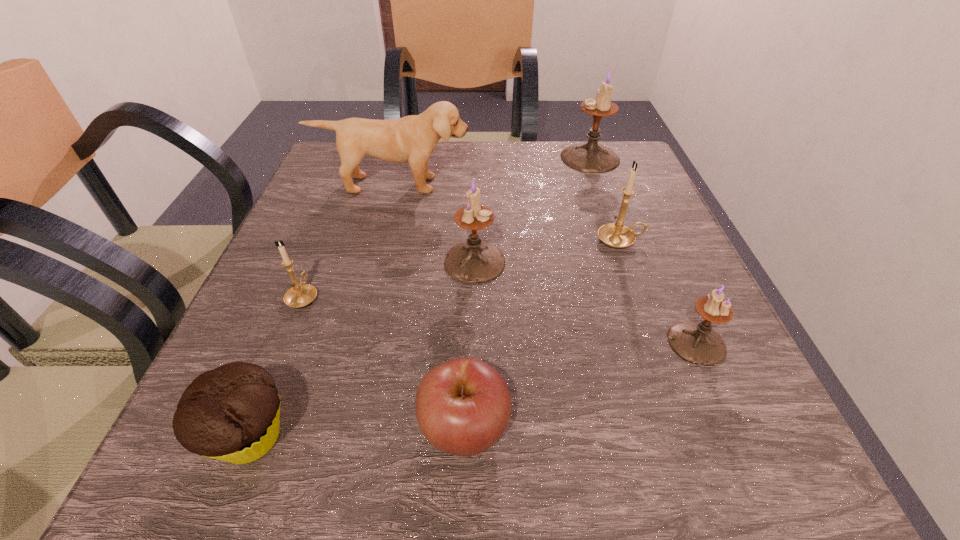
Select which object appears as the sixth closest to the second farthest purple candle holder. Please provide its 2D coordinates. Your answer should be formatted as a tuple, i.e. [(x, y)], where the tuple contains the x and y coordinates of a point satisfying the conditions above.

[(232, 413)]

You are a GUI agent. You are given a task and a screenshot of the screen. Output one action in this format:
    pyautogui.click(x=<x>, y=<y>)
    Task: Click on the candle holder that can be found as the second closest to the smallest purple candle holder
    
    Given the screenshot: What is the action you would take?
    pyautogui.click(x=474, y=261)

Identify which candle holder is the nearest to the farthest candle holder. Please provide its 2D coordinates. Your answer should be formatted as a tuple, i.e. [(x, y)], where the tuple contains the x and y coordinates of a point satisfying the conditions above.

[(617, 235)]

Locate which purple candle holder ranks third in proximity to the muffin. Please provide its 2D coordinates. Your answer should be formatted as a tuple, i.e. [(x, y)], where the tuple contains the x and y coordinates of a point satisfying the conditions above.

[(590, 157)]

Where is `purple candle holder that can be found as the second closest to the smallest purple candle holder`? This screenshot has height=540, width=960. purple candle holder that can be found as the second closest to the smallest purple candle holder is located at coordinates (590, 157).

What are the coordinates of `free location that satisfies the following two spatial constraints: 1. on the left side of the nearest candle holder; 2. on the left side of the beige puppy` in the screenshot? It's located at (352, 342).

Locate an element on the screen. The height and width of the screenshot is (540, 960). vacant area in the image that satisfies the following two spatial constraints: 1. on the left side of the beige puppy; 2. on the left side of the second candle holder from left to right is located at coordinates point(373,262).

Find the location of `vacant space that satisfies the following two spatial constraints: 1. on the front side of the nearest purple candle holder; 2. on the side of the apple with the unique marking`. vacant space that satisfies the following two spatial constraints: 1. on the front side of the nearest purple candle holder; 2. on the side of the apple with the unique marking is located at coordinates (733, 428).

The width and height of the screenshot is (960, 540). I want to click on free space in the image that satisfies the following two spatial constraints: 1. on the left side of the puppy; 2. on the left side of the nearest purple candle holder, so click(x=352, y=342).